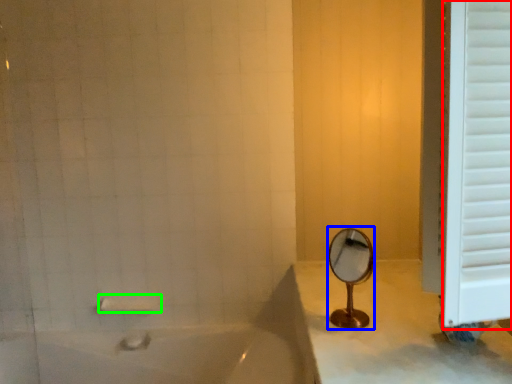
Question: Which object is positioned farthest from window frame (highlighted by a red box)? Select from mirror (highlighted by a blue box) and towel bar (highlighted by a green box).

Choices:
 (A) mirror
 (B) towel bar

Answer: (B)